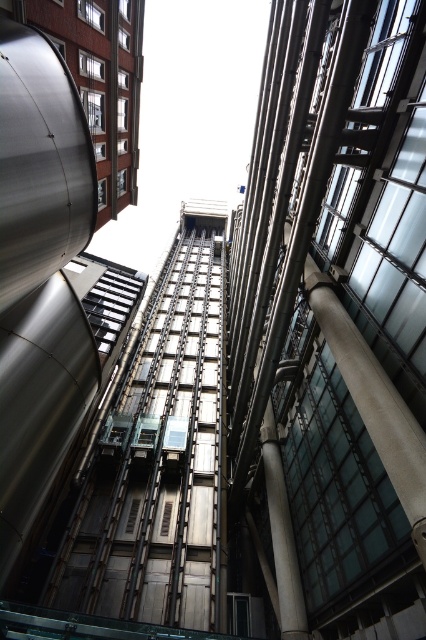
Question: Which point is farther from the camera taking this photo?

Choices:
 (A) (328, 381)
 (B) (207, 532)
 (C) (267, 484)

Answer: (B)

Question: Does metallic elevator at center have a lesser width compared to white glossy column at center?

Choices:
 (A) yes
 (B) no

Answer: (B)

Question: Which of the following is the closest to the observer?

Choices:
 (A) (419, 100)
 (B) (288, 611)
 (C) (212, 316)

Answer: (A)

Question: Is metallic elevator at center closer to the viewer compared to white glossy column at center?

Choices:
 (A) no
 (B) yes

Answer: (A)

Question: Based on their relative distances, which object is farther from the metallic elevator at center?

Choices:
 (A) white glossy column at center
 (B) metallic glass elevator at center

Answer: (B)

Question: Does metallic elevator at center have a greater width compared to white glossy column at center?

Choices:
 (A) no
 (B) yes

Answer: (B)